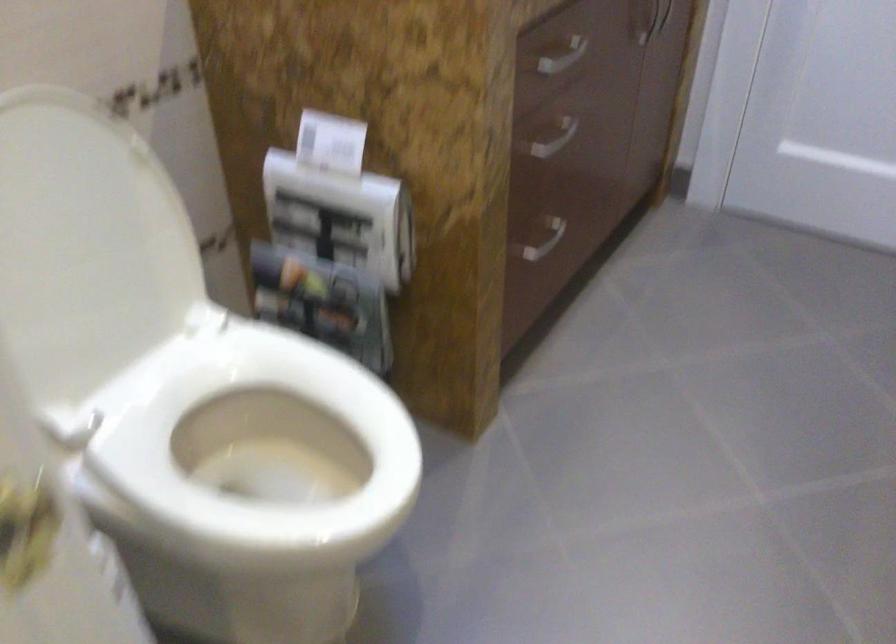
Where would you lift the white toilet seat? Please return your answer as a coordinate pair (x, y).

(257, 438)